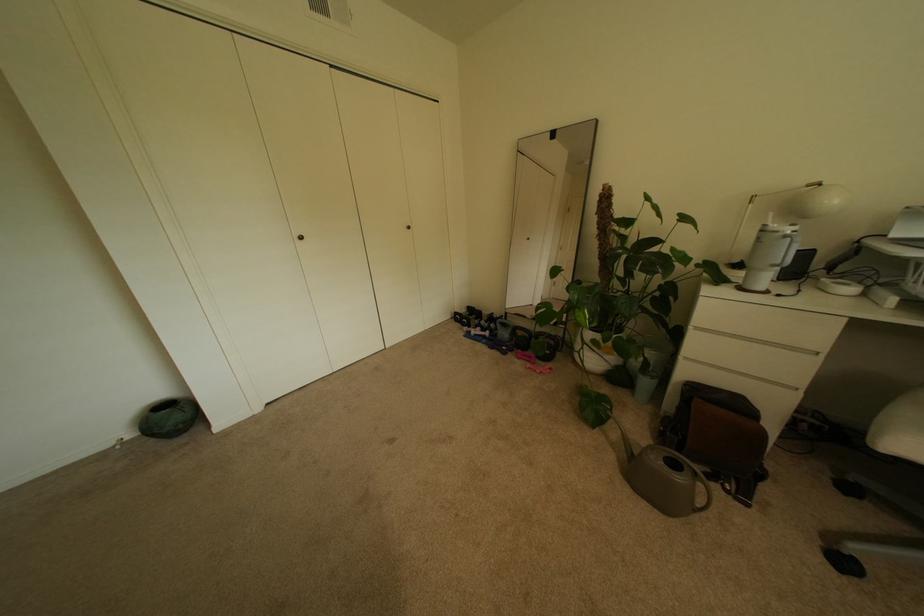
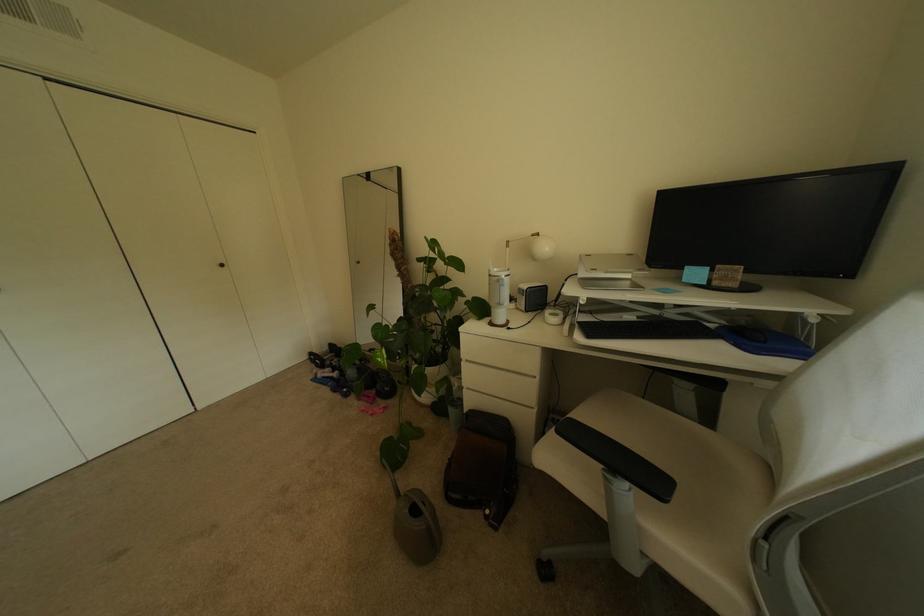
In the second image, find the point that corresponds to (x=492, y=338) in the first image.

(341, 379)